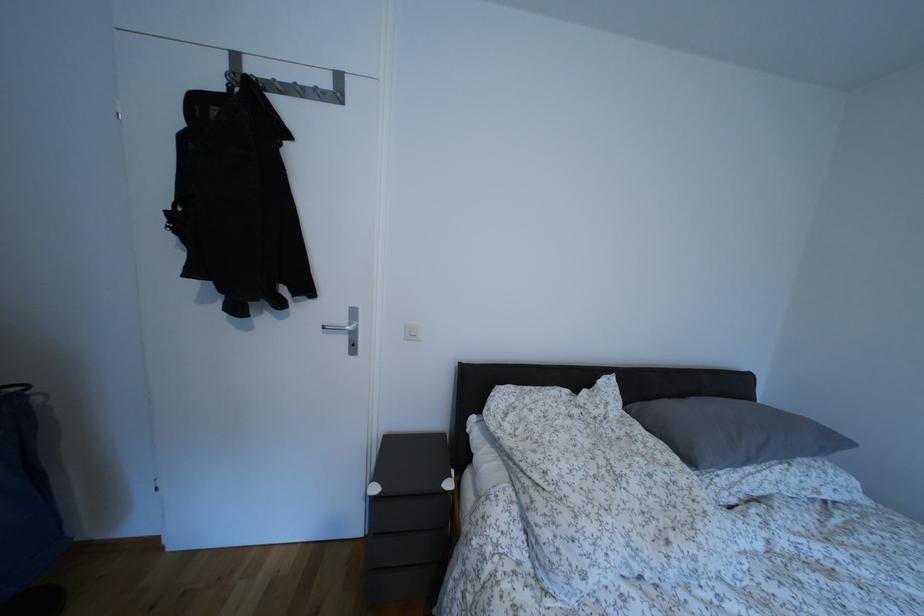
What are the coordinates of `white light switch` in the screenshot? It's located at (411, 331).